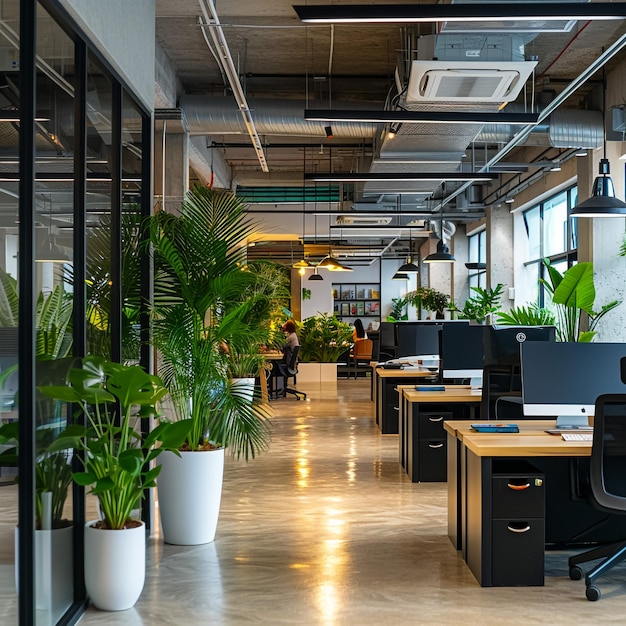
This screenshot has width=626, height=626. Identify the location of tile floor. (316, 509).